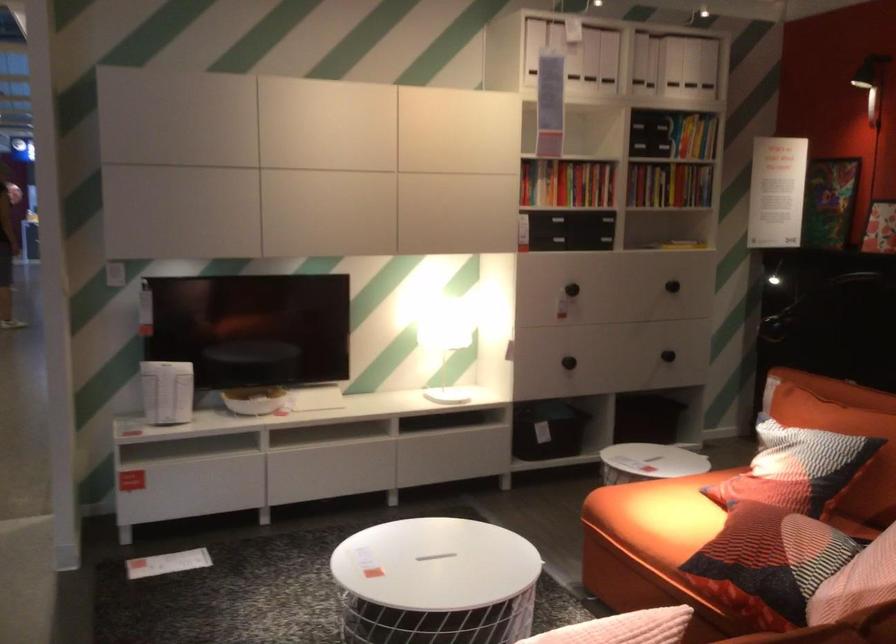
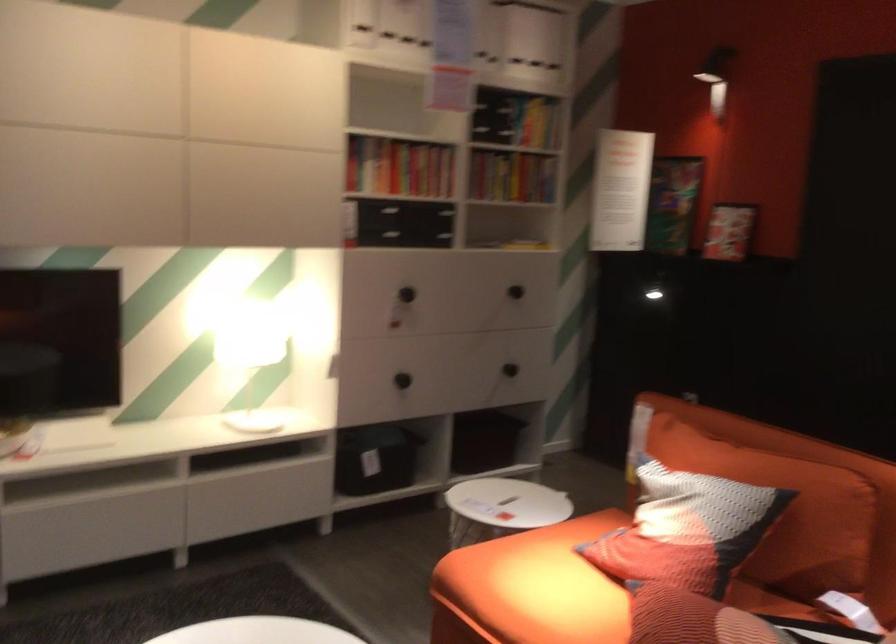
Find the pixel in the second image that matches pixel 702 120 in the first image.

(538, 124)